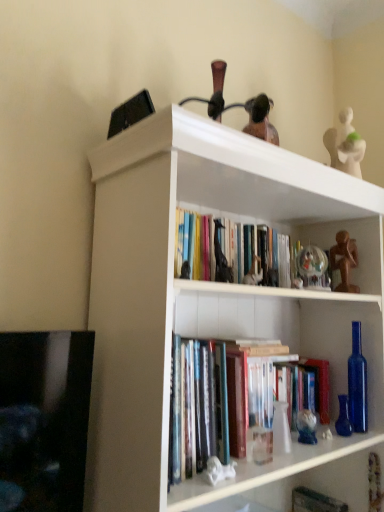
Question: From the image's perspective, is matte black giraffe at center, the 4th toy when ordered from right to left, above or below hardcover book at center?

Choices:
 (A) below
 (B) above

Answer: (B)

Question: Based on their sizes in the image, would you say matte black giraffe at center, the 4th toy when ordered from right to left, is bigger or smaller than hardcover book at center?

Choices:
 (A) small
 (B) big

Answer: (A)

Question: Which is farther from the translucent glass figurine at center, which is the 3th toy in right-to-left order?

Choices:
 (A) hardcover book at center
 (B) hardcover books at center
 (C) white glossy statue at lower center, the 1th toy positioned from the left
 (D) matte black giraffe at center, which appears as the 2th toy when viewed from the front
 (E) transparent glass globe at upper center, which is the 4th toy from front to back

Answer: (B)

Question: Which object is the farthest from the translucent glass figurine at center, the first toy from the bottom?

Choices:
 (A) white glossy statue at lower center, acting as the 5th toy starting from the back
 (B) hardcover books at center
 (C) white glossy bookshelf at upper center
 (D) matte black giraffe at center, which is counted as the 4th toy, starting from the back
 (E) hardcover book at center

Answer: (B)